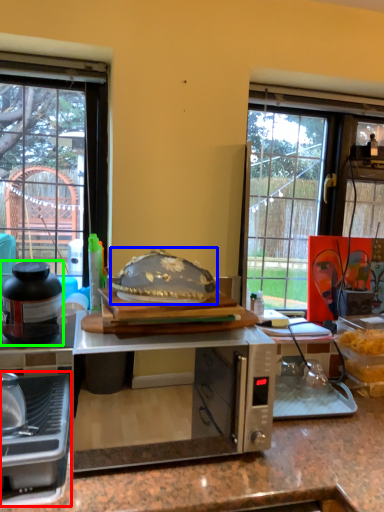
Question: Based on their relative distances, which object is nearer to kitchen appliance (highlighted by a red box)? Choose from food (highlighted by a blue box) and kitchen appliance (highlighted by a green box).

Choices:
 (A) food
 (B) kitchen appliance

Answer: (B)